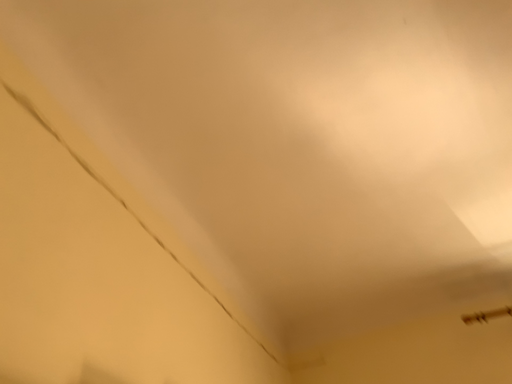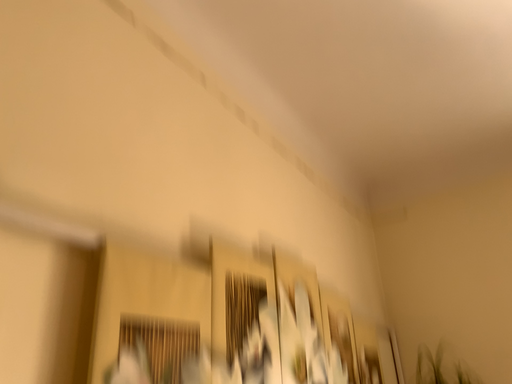
Question: How did the camera likely rotate when shooting the video?

Choices:
 (A) rotated left
 (B) rotated right

Answer: (A)